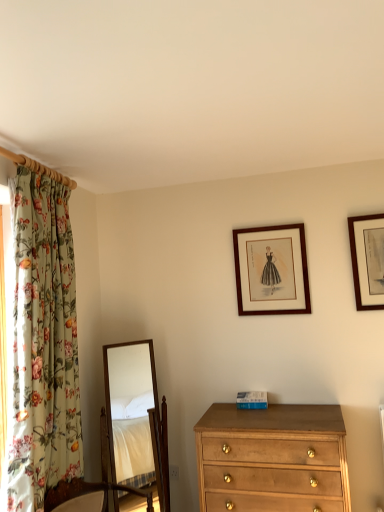
Question: Is wooden mirror at center to the left of wooden picture frame at upper right, which ranks as the 1th picture frame in front-to-back order, from the viewer's perspective?

Choices:
 (A) no
 (B) yes

Answer: (B)

Question: Could you tell me if wooden mirror at center is turned towards wooden picture frame at upper right, which is the second picture frame from left to right?

Choices:
 (A) yes
 (B) no

Answer: (B)

Question: Is wooden mirror at center closer to the viewer compared to wooden picture frame at upper right, which ranks as the 1th picture frame in front-to-back order?

Choices:
 (A) no
 (B) yes

Answer: (B)

Question: Is wooden mirror at center far from wooden picture frame at upper right, which is the second picture frame from left to right?

Choices:
 (A) yes
 (B) no

Answer: (A)

Question: Is wooden mirror at center positioned behind wooden picture frame at upper right, the 2th picture frame viewed from the back?

Choices:
 (A) yes
 (B) no

Answer: (B)

Question: Does point (352, 257) appear closer or farther from the camera than point (269, 292)?

Choices:
 (A) closer
 (B) farther

Answer: (A)

Question: Is wooden picture frame at upper right, marked as the first picture frame in a right-to-left arrangement, in front of or behind wooden framed print at upper center, the first picture frame positioned from the back, in the image?

Choices:
 (A) behind
 (B) front

Answer: (B)

Question: In terms of height, does wooden picture frame at upper right, marked as the first picture frame in a right-to-left arrangement, look taller or shorter compared to wooden framed print at upper center, which is the 2th picture frame from right to left?

Choices:
 (A) tall
 (B) short

Answer: (A)

Question: Based on their positions, is wooden picture frame at upper right, which is the second picture frame from left to right, located to the left or right of wooden framed print at upper center, acting as the second picture frame starting from the front?

Choices:
 (A) left
 (B) right

Answer: (B)

Question: Considering the positions of floral fabric curtain at left and wooden framed print at upper center, the first picture frame positioned from the back, in the image, is floral fabric curtain at left bigger or smaller than wooden framed print at upper center, the first picture frame positioned from the back,?

Choices:
 (A) big
 (B) small

Answer: (A)

Question: From the image's perspective, is floral fabric curtain at left located above or below wooden framed print at upper center, the first picture frame positioned from the back?

Choices:
 (A) below
 (B) above

Answer: (A)

Question: From a real-world perspective, relative to wooden framed print at upper center, acting as the second picture frame starting from the front, is floral fabric curtain at left vertically above or below?

Choices:
 (A) above
 (B) below

Answer: (B)

Question: In terms of height, does floral fabric curtain at left look taller or shorter compared to wooden framed print at upper center, which is the 2th picture frame from right to left?

Choices:
 (A) short
 (B) tall

Answer: (B)

Question: Considering the positions of wooden mirror at center and wooden framed print at upper center, which is the 2th picture frame from right to left, in the image, is wooden mirror at center wider or thinner than wooden framed print at upper center, which is the 2th picture frame from right to left,?

Choices:
 (A) wide
 (B) thin

Answer: (A)

Question: Considering the relative positions of wooden mirror at center and wooden framed print at upper center, which is the 2th picture frame from right to left, in the image provided, is wooden mirror at center to the left or to the right of wooden framed print at upper center, which is the 2th picture frame from right to left,?

Choices:
 (A) left
 (B) right

Answer: (A)